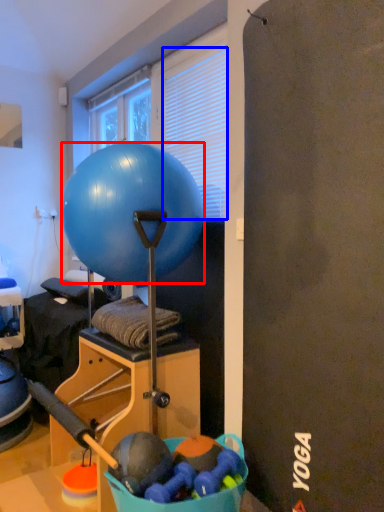
Question: Which object is further to the camera taking this photo, ball (highlighted by a red box) or blind (highlighted by a blue box)?

Choices:
 (A) ball
 (B) blind

Answer: (B)